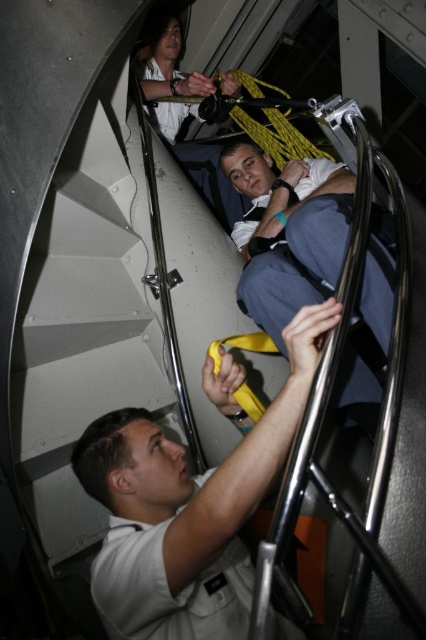
Between white matte shirt at center and light blue denim pants at center, which one appears on the right side from the viewer's perspective?

From the viewer's perspective, light blue denim pants at center appears more on the right side.

Which is above, white matte shirt at center or light blue denim pants at center?

light blue denim pants at center is higher up.

This screenshot has width=426, height=640. Find the location of `white matte shirt at center`. white matte shirt at center is located at coordinates click(187, 509).

Who is positioned more to the right, white/stainless steel stairs at lower left or matte white shirt at upper center?

matte white shirt at upper center

Who is more distant from viewer, [55,499] or [169,72]?

The point [169,72] is behind.

Find the location of a particular element. white/stainless steel stairs at lower left is located at coordinates (80, 337).

Is light blue denim pants at center smaller than matte white shirt at upper center?

No.

Between point (296, 305) and point (195, 83), which one is positioned in front?

Point (296, 305)

What do you see at coordinates (287, 232) in the screenshot? I see `light blue denim pants at center` at bounding box center [287, 232].

Locate an element on the screen. light blue denim pants at center is located at coordinates (287, 232).